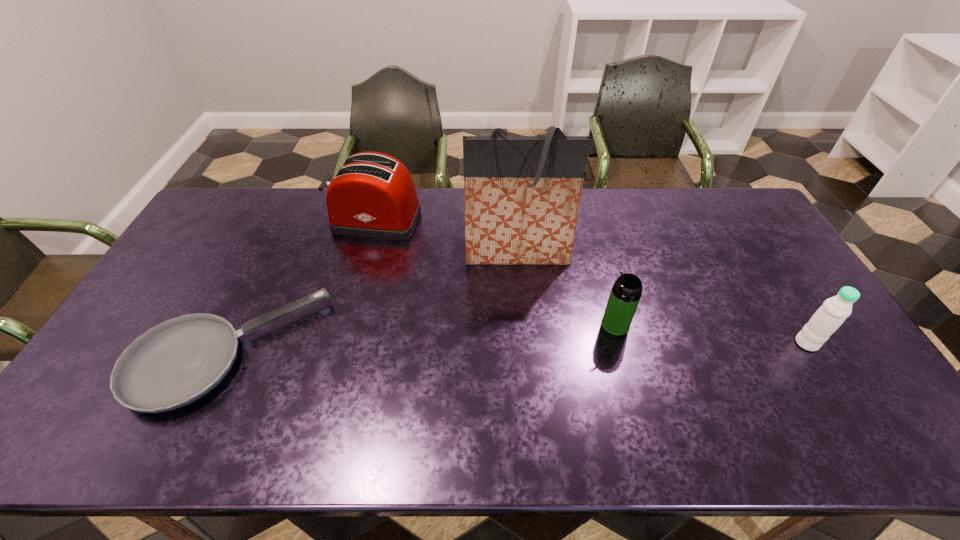
Image resolution: width=960 pixels, height=540 pixels. I want to click on blank region between the second object from right to left and the frying pan, so click(421, 338).

Identify which object is located as the nearest to the shortest object. Please provide its 2D coordinates. Your answer should be formatted as a tuple, i.e. [(x, y)], where the tuple contains the x and y coordinates of a point satisfying the conditions above.

[(372, 195)]

Identify which object is located as the third nearest to the tallest object. Please provide its 2D coordinates. Your answer should be formatted as a tuple, i.e. [(x, y)], where the tuple contains the x and y coordinates of a point satisfying the conditions above.

[(173, 364)]

The image size is (960, 540). I want to click on free space that satisfies the following two spatial constraints: 1. from the spout of the second object from right to left; 2. on the right side of the rightmost object, so click(620, 343).

Locate an element on the screen. Image resolution: width=960 pixels, height=540 pixels. free space that satisfies the following two spatial constraints: 1. from the spout of the water bottle; 2. on the right side of the second object from right to left is located at coordinates (620, 343).

At what (x,y) coordinates should I click in order to perform the action: click on free region that satisfies the following two spatial constraints: 1. on the front-facing side of the rightmost object; 2. on the left side of the third object from right to left. Please return your answer as a coordinate pair (x, y). The height and width of the screenshot is (540, 960). Looking at the image, I should click on (525, 343).

In order to click on vacant position in the image that satisfies the following two spatial constraints: 1. on the front-facing side of the shopping bag; 2. on the right side of the water bottle in this screenshot , I will do tap(525, 343).